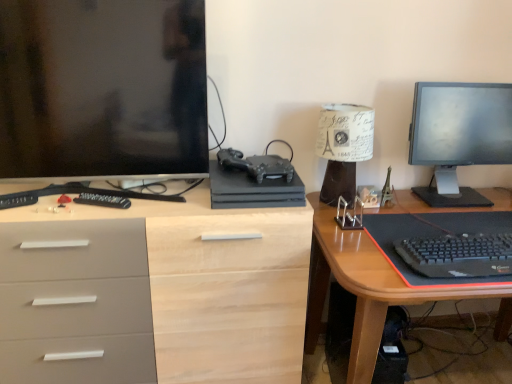
Locate an element on the screen. free space that is in between matte black monitor at left and black plastic remote control at left, which is counted as the 1th remote control, starting from the right is located at coordinates (97, 203).